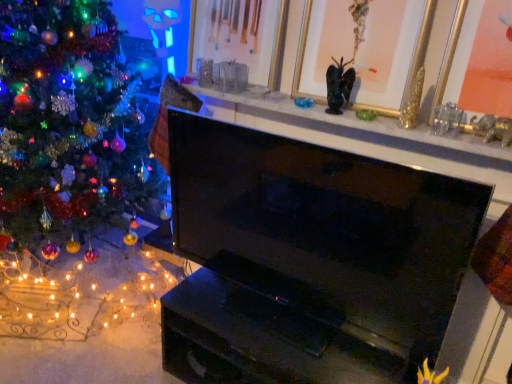
In order to face black glossy tv at center, should I rotate leftwards or rightwards?

Turn right by 5.020 degrees to look at black glossy tv at center.

This screenshot has height=384, width=512. I want to click on gold-framed picture at upper center, the 3th picture frame when ordered from right to left, so click(243, 39).

This screenshot has width=512, height=384. I want to click on gold metallic picture frame at upper right, which appears as the first picture frame when viewed from the right, so click(484, 62).

Measure the distance between gold metallic picture frame at upper right, which appears as the first picture frame when viewed from the right, and camera.

gold metallic picture frame at upper right, which appears as the first picture frame when viewed from the right, and camera are 1.23 meters apart from each other.

Locate an element on the screen. This screenshot has height=384, width=512. matte black fireplace at upper center is located at coordinates (362, 129).

In order to face matte black fireplace at upper center, should I rotate leftwards or rightwards?

To face it directly, rotate right by 8.355 degrees.

This screenshot has width=512, height=384. In order to click on black glossy tv at center in this screenshot , I will do `click(309, 259)`.

Is shiny multicolored ornaments at left to the left of black glossy tv at center from the viewer's perspective?

Yes, shiny multicolored ornaments at left is to the left of black glossy tv at center.

In the image, there is a black glossy tv at center. Find the location of `christmas tree below it (from a real-world perspective)`. christmas tree below it (from a real-world perspective) is located at coordinates (67, 123).

Is shiny multicolored ornaments at left not close to black glossy tv at center?

They are positioned close to each other.

Considering the sizes of matte black fireplace at upper center and gold/gilded picture frame at upper center, the 2th picture frame from the left, in the image, is matte black fireplace at upper center wider or thinner than gold/gilded picture frame at upper center, the 2th picture frame from the left,?

Clearly, matte black fireplace at upper center has more width compared to gold/gilded picture frame at upper center, the 2th picture frame from the left.

Is matte black fireplace at upper center closer to camera compared to gold/gilded picture frame at upper center, the 2th picture frame from the left?

Yes, it is.

From a real-world perspective, between matte black fireplace at upper center and gold/gilded picture frame at upper center, the 2th picture frame from the left, who is vertically lower?

In real-world perspective, matte black fireplace at upper center is lower.

From the picture: What's the angular difference between black glossy tv at center and shiny multicolored ornaments at left's facing directions?

The angular difference between black glossy tv at center and shiny multicolored ornaments at left is 2.17 degrees.

Does black glossy tv at center have a greater width compared to shiny multicolored ornaments at left?

Incorrect, the width of black glossy tv at center does not surpass that of shiny multicolored ornaments at left.

From the image's perspective, who appears lower, black glossy tv at center or shiny multicolored ornaments at left?

black glossy tv at center, from the image's perspective.

How distant is black glossy tv at center from shiny multicolored ornaments at left?

The distance of black glossy tv at center from shiny multicolored ornaments at left is 34.74 inches.

Is gold metallic picture frame at upper right, the third picture frame positioned from the left, placed right next to gold-framed picture at upper center, the 3th picture frame when ordered from right to left?

No, gold metallic picture frame at upper right, the third picture frame positioned from the left, is not in contact with gold-framed picture at upper center, the 3th picture frame when ordered from right to left.

Is gold metallic picture frame at upper right, the third picture frame positioned from the left, to the left or to the right of gold-framed picture at upper center, the 3th picture frame when ordered from right to left, in the image?

Clearly, gold metallic picture frame at upper right, the third picture frame positioned from the left, is on the right of gold-framed picture at upper center, the 3th picture frame when ordered from right to left, in the image.

Based on the photo, is gold metallic picture frame at upper right, which appears as the first picture frame when viewed from the right, oriented towards gold-framed picture at upper center, positioned as the 1th picture frame in left-to-right order?

No, gold metallic picture frame at upper right, which appears as the first picture frame when viewed from the right, does not turn towards gold-framed picture at upper center, positioned as the 1th picture frame in left-to-right order.

Image resolution: width=512 pixels, height=384 pixels. I want to click on the 1st picture frame located above the gold-framed picture at upper center, the 3th picture frame when ordered from right to left (from a real-world perspective), so click(x=484, y=62).

Which object is thinner, black glossy tv at center or gold/gilded picture frame at upper center, the 2th picture frame from the left?

Thinner between the two is black glossy tv at center.

Based on their sizes in the image, would you say black glossy tv at center is bigger or smaller than gold/gilded picture frame at upper center, which is the 2th picture frame from right to left?

Considering their sizes, black glossy tv at center takes up more space than gold/gilded picture frame at upper center, which is the 2th picture frame from right to left.

Is point (361, 184) farther from camera compared to point (303, 12)?

No, it is in front of (303, 12).

The width and height of the screenshot is (512, 384). I want to click on television below the gold/gilded picture frame at upper center, which is the 2th picture frame from right to left (from the image's perspective), so click(x=309, y=259).

Can you confirm if gold metallic picture frame at upper right, which appears as the first picture frame when viewed from the right, is smaller than shiny multicolored ornaments at left?

Correct, gold metallic picture frame at upper right, which appears as the first picture frame when viewed from the right, occupies less space than shiny multicolored ornaments at left.

This screenshot has height=384, width=512. In order to click on picture frame in front of the shiny multicolored ornaments at left in this screenshot , I will do `click(484, 62)`.

From a real-world perspective, is gold metallic picture frame at upper right, which appears as the first picture frame when viewed from the right, positioned above or below shiny multicolored ornaments at left?

From a real-world perspective, gold metallic picture frame at upper right, which appears as the first picture frame when viewed from the right, is physically above shiny multicolored ornaments at left.

Would you say shiny multicolored ornaments at left is part of gold metallic picture frame at upper right, the third picture frame positioned from the left,'s contents?

No, gold metallic picture frame at upper right, the third picture frame positioned from the left, does not contain shiny multicolored ornaments at left.

Is the surface of gold-framed picture at upper center, the 3th picture frame when ordered from right to left, in direct contact with shiny multicolored ornaments at left?

gold-framed picture at upper center, the 3th picture frame when ordered from right to left, and shiny multicolored ornaments at left are clearly separated.

From a real-world perspective, is gold-framed picture at upper center, the 3th picture frame when ordered from right to left, below shiny multicolored ornaments at left?

No.

You are a GUI agent. You are given a task and a screenshot of the screen. Output one action in this format:
    pyautogui.click(x=<x>, y=<y>)
    Task: Click on the christmas tree below the gold-framed picture at upper center, the 3th picture frame when ordered from right to left (from a real-world perspective)
    This screenshot has width=512, height=384.
    Given the screenshot: What is the action you would take?
    pyautogui.click(x=67, y=123)

Is gold-framed picture at upper center, positioned as the 1th picture frame in left-to-right order, facing away from shiny multicolored ornaments at left?

That's not correct — gold-framed picture at upper center, positioned as the 1th picture frame in left-to-right order, is not looking away from shiny multicolored ornaments at left.

I want to click on christmas tree behind the black glossy tv at center, so [67, 123].

At what (x,y) coordinates should I click in order to perform the action: click on mantle below the gold/gilded picture frame at upper center, which is the 2th picture frame from right to left (from a real-world perspective). Please return your answer as a coordinate pair (x, y). Looking at the image, I should click on (362, 129).

Estimate the real-world distances between objects in this image. Which object is further from gold/gilded picture frame at upper center, the 2th picture frame from the left, matte black fireplace at upper center or gold metallic picture frame at upper right, which appears as the first picture frame when viewed from the right?

gold metallic picture frame at upper right, which appears as the first picture frame when viewed from the right.

Looking at the image, which one is located closer to gold metallic picture frame at upper right, the third picture frame positioned from the left, gold-framed picture at upper center, positioned as the 1th picture frame in left-to-right order, or matte black fireplace at upper center?

matte black fireplace at upper center lies closer to gold metallic picture frame at upper right, the third picture frame positioned from the left, than the other object.

Which object lies nearer to the anchor point black glossy tv at center, gold/gilded picture frame at upper center, the 2th picture frame from the left, or matte black fireplace at upper center?

matte black fireplace at upper center is closer to black glossy tv at center.

From the image, which object appears to be nearer to gold-framed picture at upper center, positioned as the 1th picture frame in left-to-right order, matte black fireplace at upper center or shiny multicolored ornaments at left?

Among the two, matte black fireplace at upper center is located nearer to gold-framed picture at upper center, positioned as the 1th picture frame in left-to-right order.

In the scene shown: When comparing their distances from black glossy tv at center, does gold metallic picture frame at upper right, the third picture frame positioned from the left, or gold-framed picture at upper center, the 3th picture frame when ordered from right to left, seem closer?

The object closer to black glossy tv at center is gold-framed picture at upper center, the 3th picture frame when ordered from right to left.

When comparing their distances from matte black fireplace at upper center, does black glossy tv at center or shiny multicolored ornaments at left seem further?

Based on the image, shiny multicolored ornaments at left appears to be further to matte black fireplace at upper center.

Looking at the image, which one is located closer to gold-framed picture at upper center, positioned as the 1th picture frame in left-to-right order, black glossy tv at center or shiny multicolored ornaments at left?

black glossy tv at center.

From the image, which object appears to be farther from shiny multicolored ornaments at left, gold/gilded picture frame at upper center, which is the 2th picture frame from right to left, or black glossy tv at center?

Based on the image, gold/gilded picture frame at upper center, which is the 2th picture frame from right to left, appears to be further to shiny multicolored ornaments at left.

I want to click on picture frame between shiny multicolored ornaments at left and matte black fireplace at upper center, so click(x=243, y=39).

I want to click on mantle between shiny multicolored ornaments at left and gold metallic picture frame at upper right, the third picture frame positioned from the left, in the horizontal direction, so click(x=362, y=129).

Image resolution: width=512 pixels, height=384 pixels. In order to click on television between shiny multicolored ornaments at left and gold metallic picture frame at upper right, the third picture frame positioned from the left, from left to right in this screenshot , I will do `click(309, 259)`.

I want to click on mantle situated between gold-framed picture at upper center, positioned as the 1th picture frame in left-to-right order, and gold metallic picture frame at upper right, the third picture frame positioned from the left, from left to right, so click(362, 129).